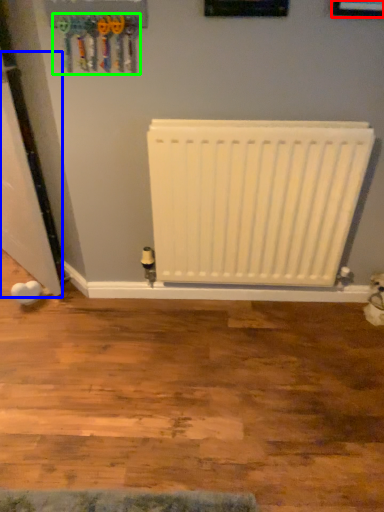
Question: Considering the real-world distances, which object is closest to picture frame (highlighted by a red box)? door (highlighted by a blue box) or tool (highlighted by a green box).

Choices:
 (A) door
 (B) tool

Answer: (B)